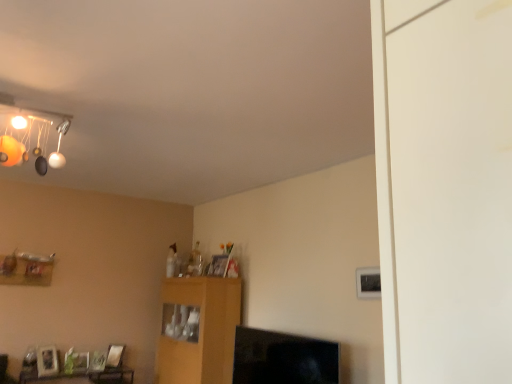
This screenshot has height=384, width=512. Identify the location of wooden cabinet at center. (198, 330).

This screenshot has width=512, height=384. What do you see at coordinates (84, 376) in the screenshot?
I see `wooden table at lower left` at bounding box center [84, 376].

Measure the distance between point (x=12, y=263) and camera.

The depth of point (x=12, y=263) is 4.19 meters.

Locate an element on the screen. This screenshot has width=512, height=384. wooden cabinet at center is located at coordinates (198, 330).

From the image's perspective, which object appears higher, wooden table at lower left or wooden shelf at lower left?

From the image's view, wooden shelf at lower left is above.

Can you tell me how much wooden table at lower left and wooden shelf at lower left differ in facing direction?

The angular difference between wooden table at lower left and wooden shelf at lower left is 0.914 degrees.

Is wooden table at lower left oriented away from wooden shelf at lower left?

That's not correct — wooden table at lower left is not looking away from wooden shelf at lower left.

Between wooden table at lower left and wooden shelf at lower left, which one appears on the left side from the viewer's perspective?

wooden shelf at lower left.

Can you tell me how much wooden shelf at lower left and wooden cabinet at center differ in facing direction?

The angle between the facing direction of wooden shelf at lower left and the facing direction of wooden cabinet at center is 89.9 degrees.

Is wooden shelf at lower left in front of or behind wooden cabinet at center in the image?

wooden shelf at lower left is behind wooden cabinet at center.

Considering the points (20, 278) and (172, 373), which point is behind, point (20, 278) or point (172, 373)?

The point (172, 373) is farther from the camera.

Is wooden shelf at lower left inside or outside of wooden cabinet at center?

wooden shelf at lower left is spatially situated outside wooden cabinet at center.

Is wooden cabinet at center looking in the opposite direction of wooden shelf at lower left?

No.

Is wooden cabinet at center inside the boundaries of wooden shelf at lower left, or outside?

wooden cabinet at center is spatially situated outside wooden shelf at lower left.

From the image's perspective, is wooden cabinet at center above or below wooden shelf at lower left?

Clearly, from the image's perspective, wooden cabinet at center is below wooden shelf at lower left.

Considering the relative sizes of wooden cabinet at center and wooden shelf at lower left in the image provided, is wooden cabinet at center bigger than wooden shelf at lower left?

Yes, wooden cabinet at center is bigger than wooden shelf at lower left.

Locate an element on the screen. table below the wooden cabinet at center (from a real-world perspective) is located at coordinates (84, 376).

From the image's perspective, between wooden table at lower left and wooden cabinet at center, who is located below?

wooden table at lower left.

Which is more to the left, wooden table at lower left or wooden cabinet at center?

Positioned to the left is wooden table at lower left.

Can you confirm if wooden cabinet at center is taller than wooden table at lower left?

Yes, wooden cabinet at center is taller than wooden table at lower left.

Is wooden cabinet at center not inside wooden table at lower left?

Absolutely, wooden cabinet at center is external to wooden table at lower left.

How much distance is there between wooden cabinet at center and wooden table at lower left?

A distance of 1.03 meters exists between wooden cabinet at center and wooden table at lower left.

From the image's perspective, relative to wooden table at lower left, is wooden cabinet at center above or below?

wooden cabinet at center is situated higher than wooden table at lower left in the image.

Is wooden shelf at lower left not near wooden table at lower left?

No, wooden shelf at lower left is not far away from wooden table at lower left.

From the image's perspective, is wooden shelf at lower left located above or below wooden table at lower left?

wooden shelf at lower left is situated higher than wooden table at lower left in the image.

Does point (1, 282) appear closer or farther from the camera than point (129, 371)?

Clearly, point (1, 282) is closer to the camera than point (129, 371).

Where is `shelf that appears above the wooden table at lower left (from the image's perspective)`? shelf that appears above the wooden table at lower left (from the image's perspective) is located at coordinates (25, 271).

This screenshot has height=384, width=512. I want to click on shelf on the left of wooden cabinet at center, so click(x=25, y=271).

From the picture: When comparing their distances from wooden shelf at lower left, does wooden cabinet at center or wooden table at lower left seem closer?

Based on the image, wooden table at lower left appears to be nearer to wooden shelf at lower left.

When comparing their distances from wooden table at lower left, does wooden cabinet at center or wooden shelf at lower left seem further?

The object further to wooden table at lower left is wooden cabinet at center.

In the scene shown: When comparing their distances from wooden table at lower left, does wooden shelf at lower left or wooden cabinet at center seem closer?

wooden shelf at lower left.

From the image, which object appears to be farther from wooden cabinet at center, wooden shelf at lower left or wooden table at lower left?

Based on the image, wooden shelf at lower left appears to be further to wooden cabinet at center.

From the image, which object appears to be farther from wooden cabinet at center, wooden table at lower left or wooden shelf at lower left?

wooden shelf at lower left is positioned further to the anchor wooden cabinet at center.

Considering their positions, is wooden table at lower left positioned further to wooden shelf at lower left than wooden cabinet at center?

wooden cabinet at center is further to wooden shelf at lower left.

Image resolution: width=512 pixels, height=384 pixels. Identify the location of table situated between wooden shelf at lower left and wooden cabinet at center from left to right. (84, 376).